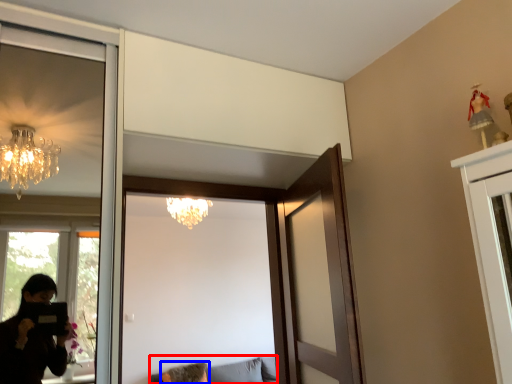
Question: Which point is further to the camera, furniture (highlighted by a red box) or woman (highlighted by a blue box)?

Choices:
 (A) furniture
 (B) woman

Answer: (B)